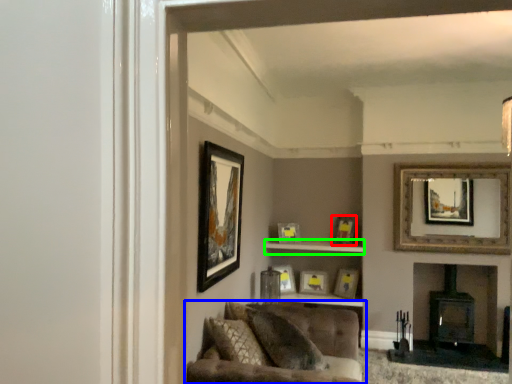
Question: Which object is positioned closest to picture frame (highlighted by a red box)? Select from studio couch (highlighted by a blue box) and cabinet (highlighted by a green box).

Choices:
 (A) studio couch
 (B) cabinet

Answer: (B)